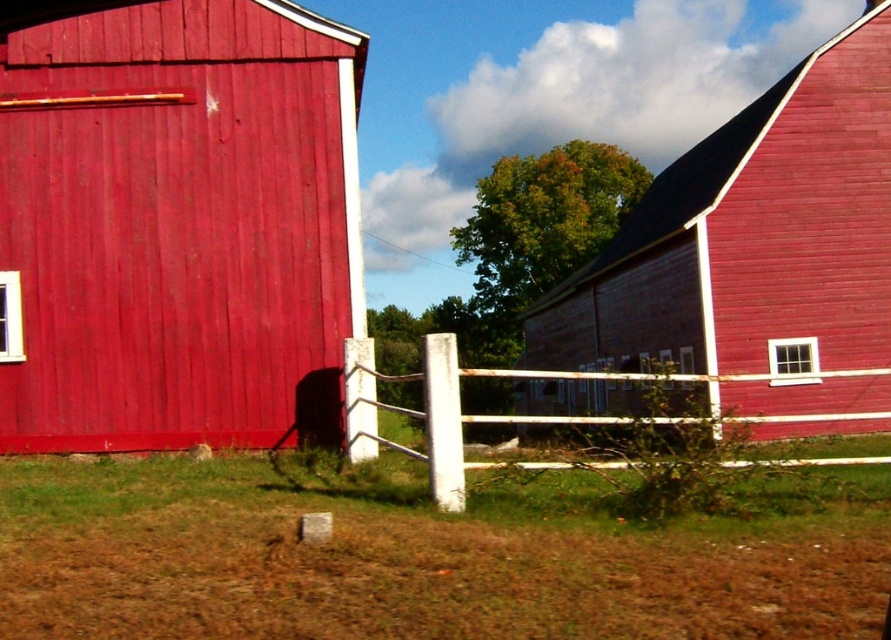
Is matte wood barn at center bigger than white wooden fence at center?

Actually, matte wood barn at center might be smaller than white wooden fence at center.

Does matte wood barn at center have a lesser width compared to white wooden fence at center?

Indeed, matte wood barn at center has a lesser width compared to white wooden fence at center.

This screenshot has width=891, height=640. I want to click on matte wood barn at center, so click(178, 225).

Locate an element on the screen. The height and width of the screenshot is (640, 891). matte wood barn at center is located at coordinates (178, 225).

Is point (536, 394) more distant than point (470, 468)?

Yes, it is behind point (470, 468).

Which is in front, point (783, 83) or point (432, 442)?

Point (432, 442)

This screenshot has width=891, height=640. Identify the location of smooth wooden barn at center. (751, 237).

Between matte wood barn at center and smooth wooden barn at center, which one has less height?

With less height is matte wood barn at center.

Between point (39, 440) and point (827, 225), which one is positioned behind?

Point (827, 225)

Where is `matte wood barn at center`? matte wood barn at center is located at coordinates (178, 225).